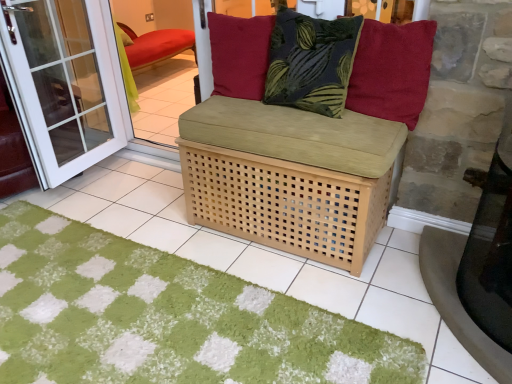
Where is `free space in front of dark green textured pillow at center, arranged as the second pillow when viewed from the right`? This screenshot has height=384, width=512. free space in front of dark green textured pillow at center, arranged as the second pillow when viewed from the right is located at coordinates (333, 132).